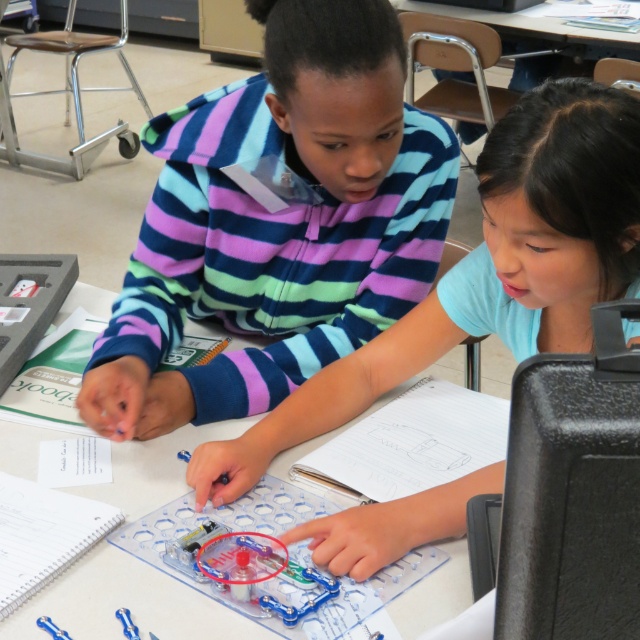
In the scene shown: You are a teacher observing the classroom activity. You need to place a new item on the table that must be wider than both the striped fleece at center and the matte plastic toy at center. Which object should you compare the width of the new item to ensure it meets the requirement?

You should compare the width of the new item to the matte plastic toy at center because it is wider than the striped fleece at center. The new item must be wider than the matte plastic toy at center to satisfy both conditions.

You are a teacher observing the classroom scene. You notice a point at coordinates (488, 269) on the table. What object is located at that point?

The point at coordinates (488, 269) corresponds to the matte plastic toy at center.

You are a teacher observing the classroom scene. You notice the striped fleece at center and a camera in the image. How far apart are these two items?

The striped fleece at center and the camera are 88.00 centimeters apart.